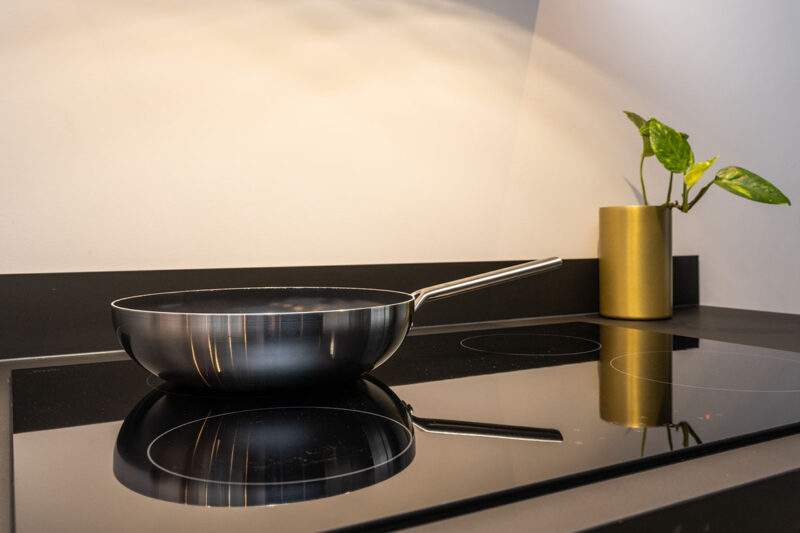
Identify the location of front left burner. The width and height of the screenshot is (800, 533). (288, 450).